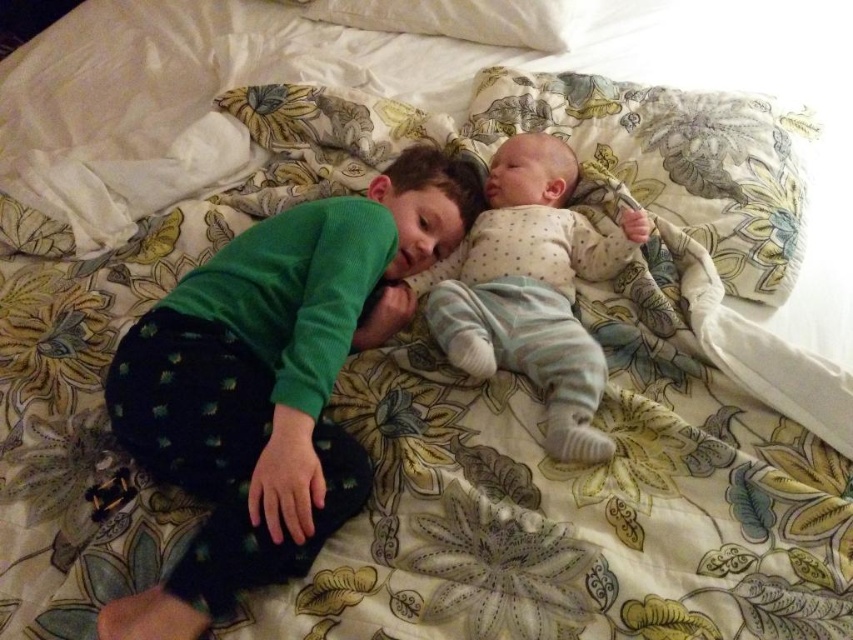
Question: Considering the relative positions of green fleece pants at left and light blue cotton onesie at center in the image provided, where is green fleece pants at left located with respect to light blue cotton onesie at center?

Choices:
 (A) above
 (B) below

Answer: (B)

Question: Which of the following is the closest to the observer?

Choices:
 (A) (735, 132)
 (B) (120, 410)
 (C) (519, 36)

Answer: (B)

Question: Which of the following is the closest to the observer?

Choices:
 (A) [341, 524]
 (B) [677, 186]
 (C) [550, 394]
 (D) [631, 3]

Answer: (A)

Question: Is green fleece pants at left further to the viewer compared to white soft pillow at upper center?

Choices:
 (A) yes
 (B) no

Answer: (B)

Question: Which object is farther from the camera taking this photo?

Choices:
 (A) green fleece pants at left
 (B) light blue cotton onesie at center
 (C) fluffy fabric pillow at upper center

Answer: (C)

Question: Does light blue cotton onesie at center have a larger size compared to white soft pillow at upper center?

Choices:
 (A) no
 (B) yes

Answer: (B)